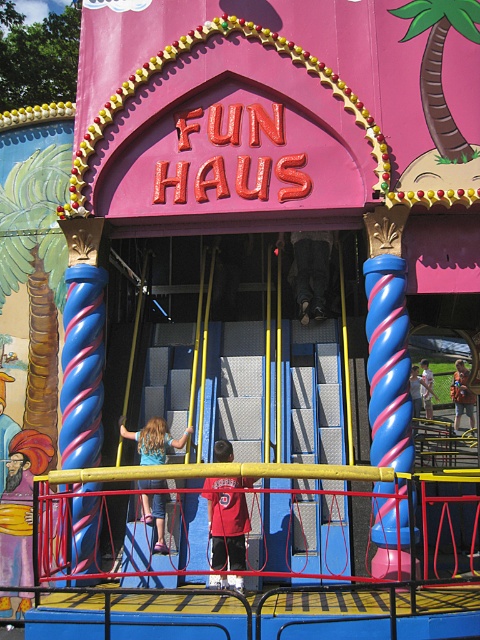
Is point (239, 566) more distant than point (158, 420)?

No, (239, 566) is in front of (158, 420).

Is red shirt at center positioned behind blue denim shorts at center?

No, red shirt at center is closer to the viewer.

Does point (208, 531) come closer to viewer compared to point (153, 440)?

That is True.

Find the location of a particular element. The width and height of the screenshot is (480, 640). red shirt at center is located at coordinates (228, 529).